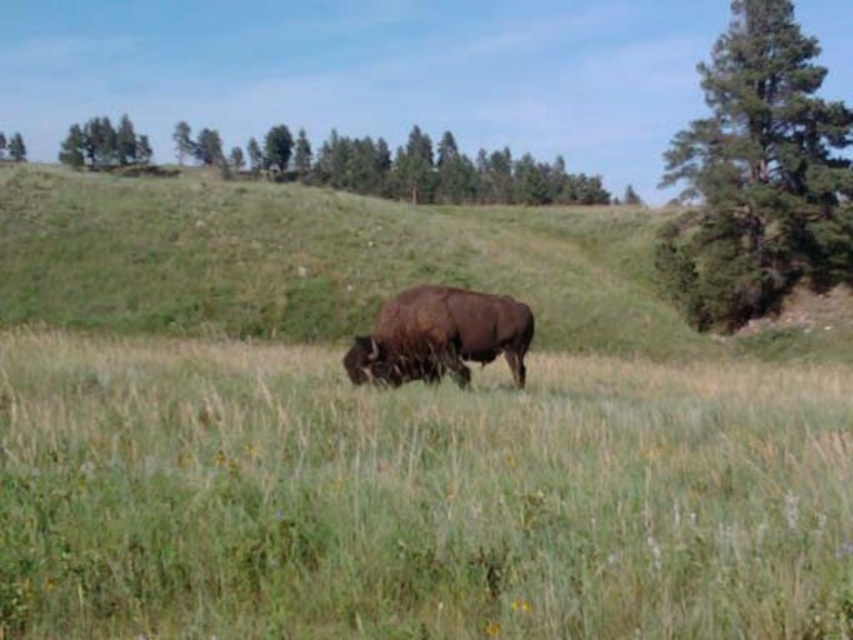
Question: Which point appears farthest from the camera in this image?

Choices:
 (A) (781, 90)
 (B) (91, 147)
 (C) (370, 356)

Answer: (B)

Question: Which object is positioned farthest from the green leafy tree at upper left?

Choices:
 (A) brown furry buffalo at center
 (B) green textured tree at upper right

Answer: (A)

Question: Is brown furry buffalo at center thinner than green leafy tree at upper left?

Choices:
 (A) yes
 (B) no

Answer: (A)

Question: Is green textured tree at upper right to the right of brown furry buffalo at center from the viewer's perspective?

Choices:
 (A) yes
 (B) no

Answer: (A)

Question: Which object appears closest to the camera in this image?

Choices:
 (A) brown furry buffalo at center
 (B) green leafy tree at upper left

Answer: (A)

Question: Does brown furry buffalo at center have a larger size compared to green leafy tree at upper left?

Choices:
 (A) no
 (B) yes

Answer: (A)